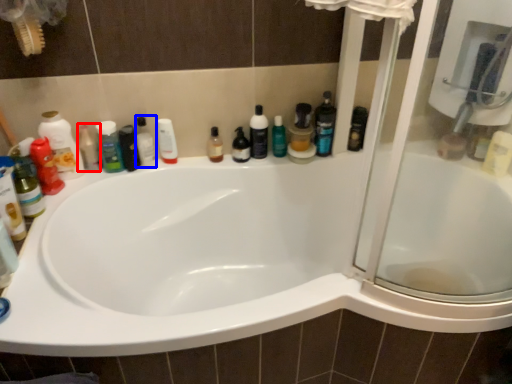
Question: Which point is further to the camera, toiletry (highlighted by a red box) or toiletry (highlighted by a blue box)?

Choices:
 (A) toiletry
 (B) toiletry

Answer: (B)